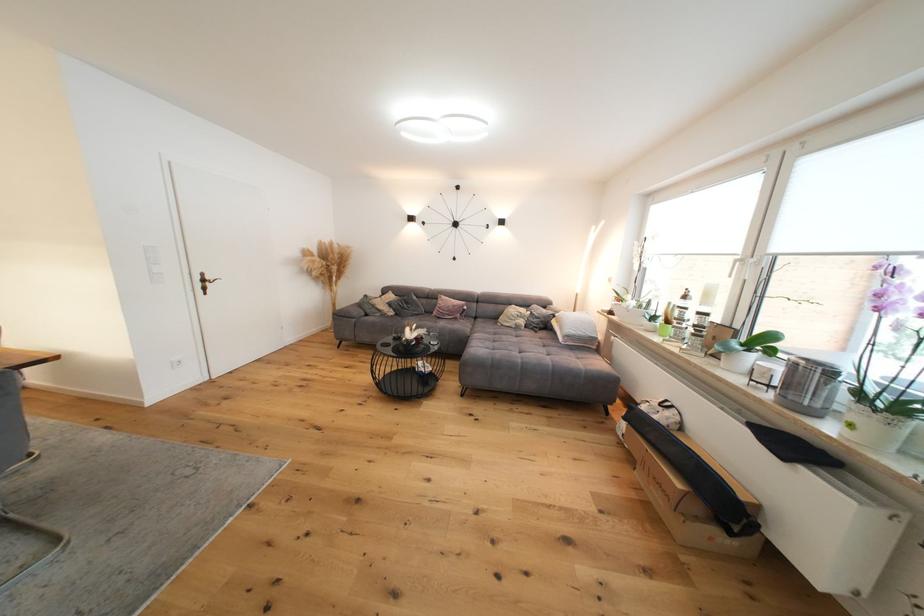
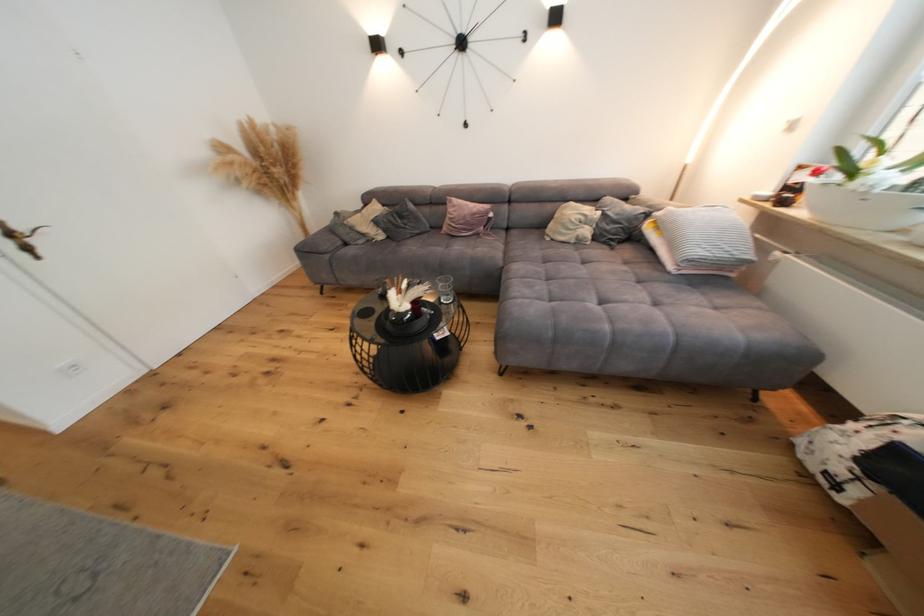
In the second image, find the point that corresponds to (x=423, y=330) in the first image.

(417, 288)